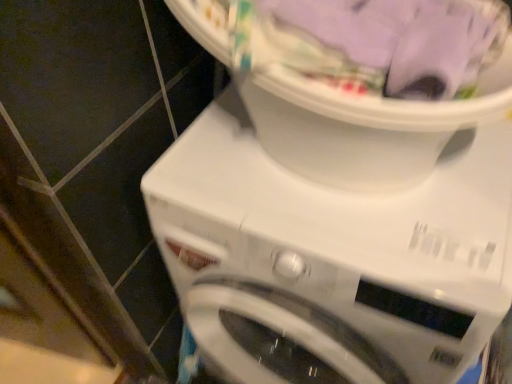
Where is `free spot above white plastic washing machine at center (from a real-world perspective)`? This screenshot has width=512, height=384. free spot above white plastic washing machine at center (from a real-world perspective) is located at coordinates (339, 202).